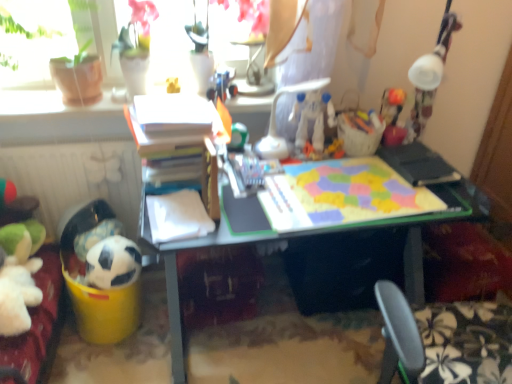
Identify the location of vacant space to the right of white plastic chair at center. (347, 172).